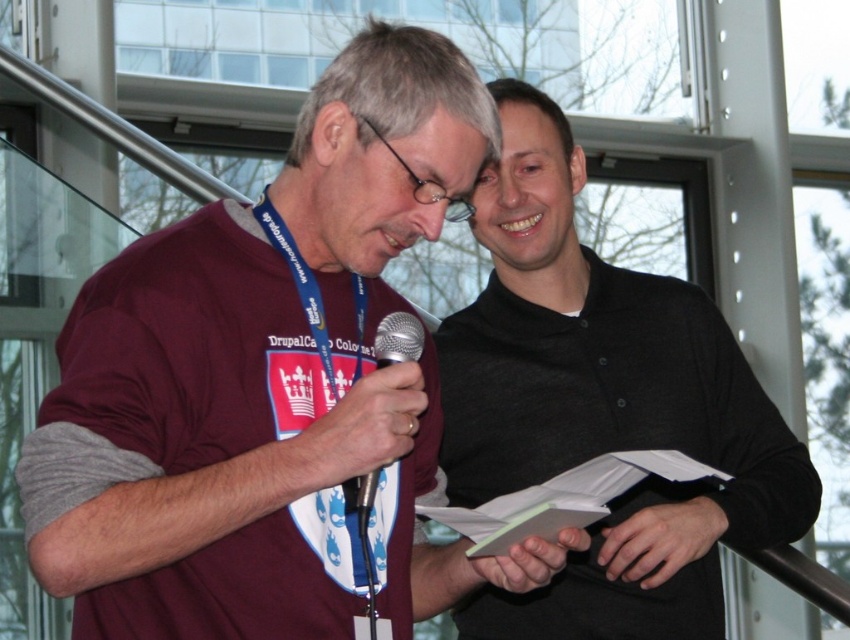
How much distance is there between blue fabric lanyard at center and metallic silver microphone at center?

They are 3.70 inches apart.

Which is more to the right, blue fabric lanyard at center or metallic silver microphone at center?

Positioned to the right is metallic silver microphone at center.

At what (x,y) coordinates should I click in order to perform the action: click on blue fabric lanyard at center. Please return your answer as a coordinate pair (x, y). Looking at the image, I should click on (299, 282).

Does maroon jersey at center have a smaller size compared to blue fabric lanyard at center?

Incorrect, maroon jersey at center is not smaller in size than blue fabric lanyard at center.

This screenshot has height=640, width=850. What do you see at coordinates (247, 364) in the screenshot?
I see `maroon jersey at center` at bounding box center [247, 364].

Image resolution: width=850 pixels, height=640 pixels. Find the location of `maroon jersey at center`. maroon jersey at center is located at coordinates (247, 364).

Based on the photo, which of these two, black matte hand at lower center or blue fabric lanyard at center, stands taller?

blue fabric lanyard at center is taller.

Can you confirm if black matte hand at lower center is positioned above blue fabric lanyard at center?

No.

Does point (618, 577) come farther from viewer compared to point (313, 304)?

That is True.

Identify the location of black matte hand at lower center. This screenshot has width=850, height=640. [x=660, y=540].